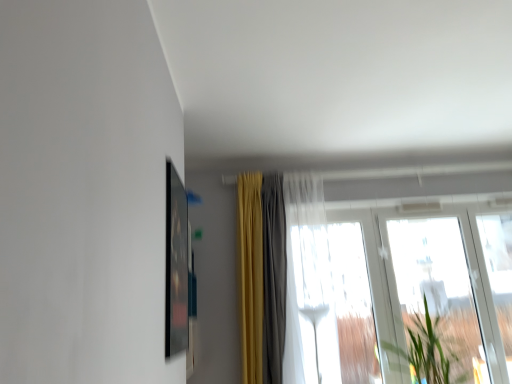
Question: Is matte black picture frame at upper left bigger than transparent glass window at right, which appears as the first window when viewed from the right?

Choices:
 (A) yes
 (B) no

Answer: (B)

Question: Is transparent glass window at right, which is the third window from left to right, at the back of matte black picture frame at upper left?

Choices:
 (A) no
 (B) yes

Answer: (A)

Question: From the image's perspective, would you say matte black picture frame at upper left is positioned over transparent glass window at right, which appears as the first window when viewed from the right?

Choices:
 (A) yes
 (B) no

Answer: (A)

Question: Is matte black picture frame at upper left not close to transparent glass window at right, which is the third window from left to right?

Choices:
 (A) yes
 (B) no

Answer: (A)

Question: Does matte black picture frame at upper left touch transparent glass window at right, which is the third window from left to right?

Choices:
 (A) yes
 (B) no

Answer: (B)

Question: Considering the positions of point (429, 365) and point (368, 296), is point (429, 365) closer or farther from the camera than point (368, 296)?

Choices:
 (A) farther
 (B) closer

Answer: (B)

Question: Considering the positions of green leafy plant at right and transparent fabric at center, which is the 3th window in right-to-left order, in the image, is green leafy plant at right bigger or smaller than transparent fabric at center, which is the 3th window in right-to-left order,?

Choices:
 (A) big
 (B) small

Answer: (A)

Question: Would you say green leafy plant at right is inside or outside transparent fabric at center, which appears as the first window when viewed from the left?

Choices:
 (A) inside
 (B) outside

Answer: (B)

Question: From the image's perspective, is green leafy plant at right above or below transparent fabric at center, which appears as the first window when viewed from the left?

Choices:
 (A) below
 (B) above

Answer: (A)

Question: In the image, is transparent glass window at right, which is the third window from left to right, on the left side or the right side of matte black picture frame at upper left?

Choices:
 (A) right
 (B) left

Answer: (A)

Question: Is transparent glass window at right, which appears as the first window when viewed from the right, situated inside matte black picture frame at upper left or outside?

Choices:
 (A) outside
 (B) inside

Answer: (A)

Question: Is transparent glass window at right, which appears as the first window when viewed from the right, in front of or behind matte black picture frame at upper left in the image?

Choices:
 (A) front
 (B) behind

Answer: (B)

Question: Considering the positions of transparent glass window at right, which appears as the first window when viewed from the right, and matte black picture frame at upper left in the image, is transparent glass window at right, which appears as the first window when viewed from the right, taller or shorter than matte black picture frame at upper left?

Choices:
 (A) short
 (B) tall

Answer: (B)

Question: In terms of width, does matte black picture frame at upper left look wider or thinner when compared to green leafy plant at right?

Choices:
 (A) thin
 (B) wide

Answer: (A)

Question: Considering their positions, is matte black picture frame at upper left located in front of or behind green leafy plant at right?

Choices:
 (A) behind
 (B) front

Answer: (B)